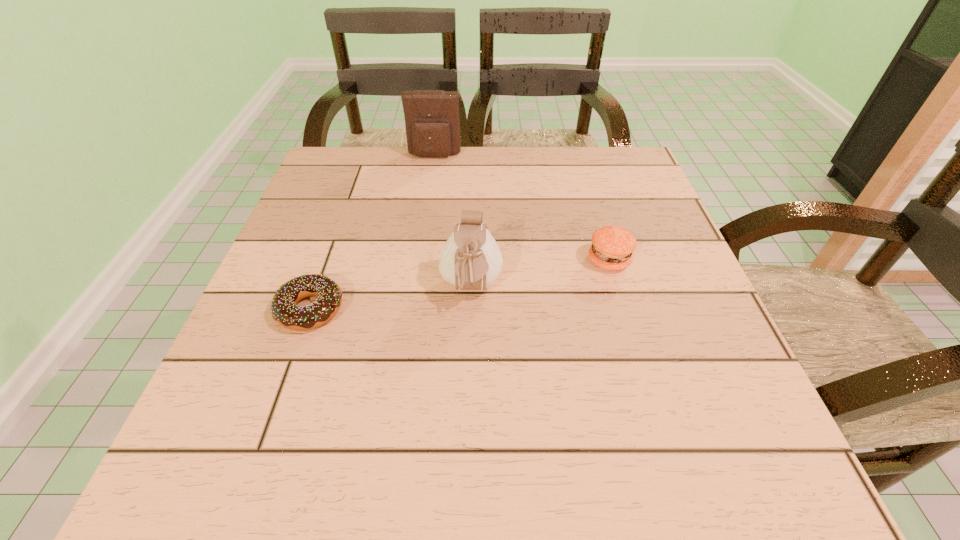
Identify the location of vacant space in between the patty and the farthest object. Image resolution: width=960 pixels, height=540 pixels. (521, 208).

At what (x,y) coordinates should I click in order to perform the action: click on vacant area that lies between the nearer pouch and the patty. Please return your answer as a coordinate pair (x, y). The image size is (960, 540). Looking at the image, I should click on (540, 275).

You are a GUI agent. You are given a task and a screenshot of the screen. Output one action in this format:
    pyautogui.click(x=<x>, y=<y>)
    Task: Click on the blank region between the shortest object and the nearer pouch
    The height and width of the screenshot is (540, 960).
    Given the screenshot: What is the action you would take?
    pyautogui.click(x=391, y=299)

This screenshot has height=540, width=960. I want to click on free area in between the farthest object and the third tallest object, so click(521, 208).

Image resolution: width=960 pixels, height=540 pixels. What are the coordinates of `vacant area that lies between the leftmost object and the farthest object` in the screenshot? It's located at (372, 233).

This screenshot has width=960, height=540. Identify the location of vacant space that's between the nearer pouch and the farthest object. (453, 222).

Locate an element on the screen. This screenshot has height=540, width=960. free point between the nearer pouch and the farthest object is located at coordinates (453, 222).

Identify the location of vacant point located between the second shortest object and the farthest object. (521, 208).

Locate an element on the screen. Image resolution: width=960 pixels, height=540 pixels. object that ranks as the third closest to the second shortest object is located at coordinates (283, 306).

I want to click on the closest object to the doughnut, so click(x=470, y=259).